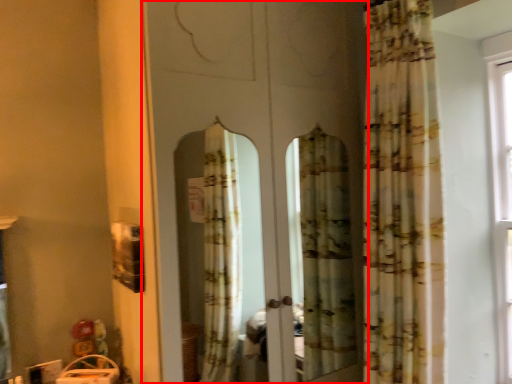
Question: From the image's perspective, where is screen door (annotated by the red box) located relative to curtain?

Choices:
 (A) below
 (B) above

Answer: (A)